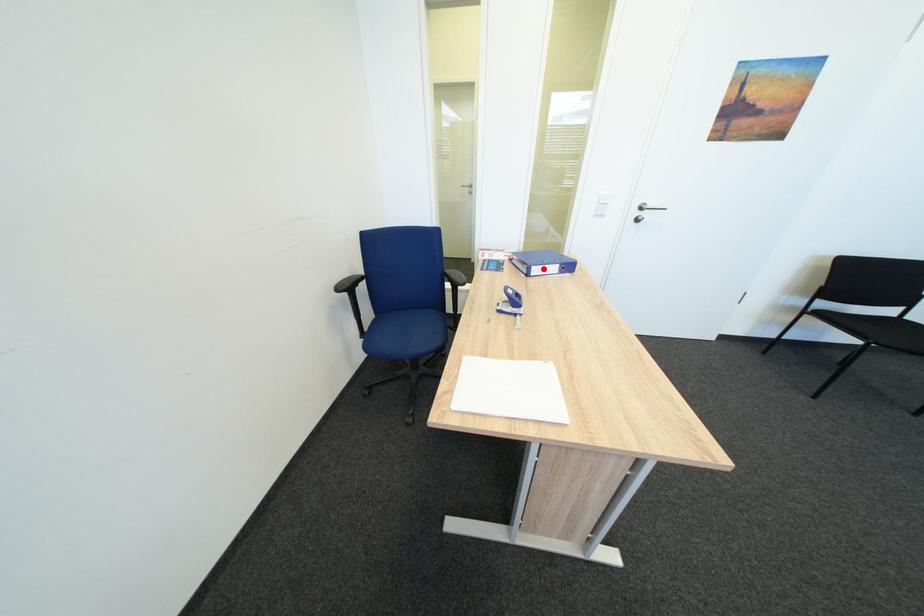
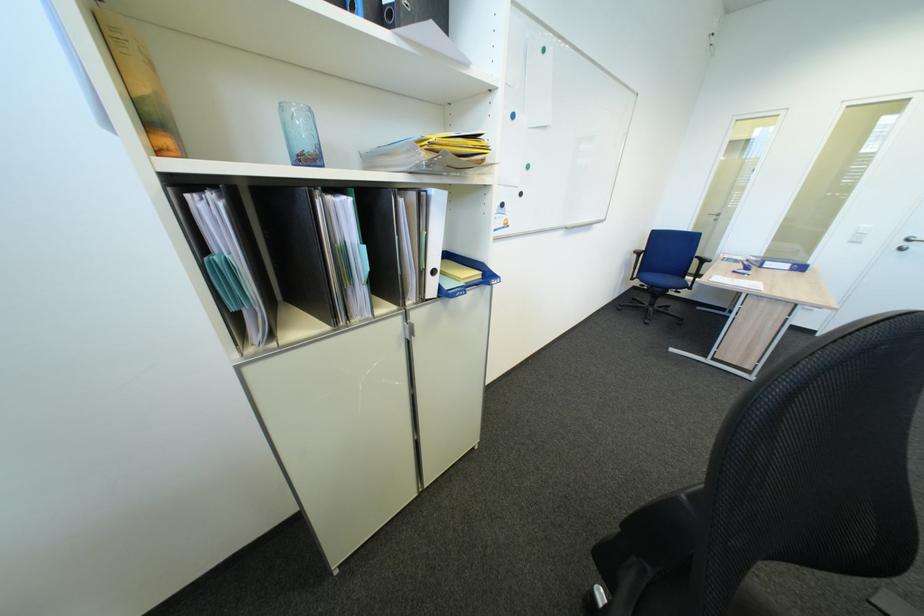
The point at the highlighted location is marked in the first image. Where is the corresponding point in the second image?

(776, 264)